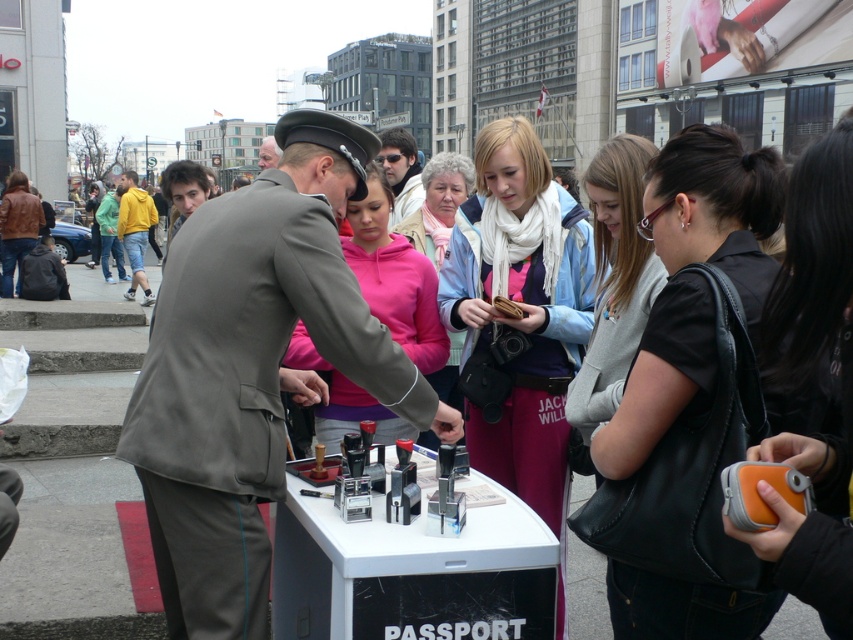
You are a photographer trying to take a picture of the passport table setup. You have an orange fabric camera at center and a pink fleece jacket at center in your view. Which object should you move to ensure the camera has a clear view?

The orange fabric camera at center is not as tall as the pink fleece jacket at center, so you should move the pink fleece jacket at center to ensure the camera has a clear view.

You are a traveler who needs to place your matte black purse at center and pink fleece jacket at center on the table. The table has limited space. Which item should you place first to ensure both fit on the table?

The matte black purse at center is bigger than the pink fleece jacket at center, so you should place the matte black purse at center first to ensure both items fit on the table.

You are standing in front of the passport table and see two points marked on the ground. The first point is at coordinate point (851, 205) and the second at point (412, 236). Which point is closer to you?

Point (851, 205) is closer to the viewer than point (412, 236).